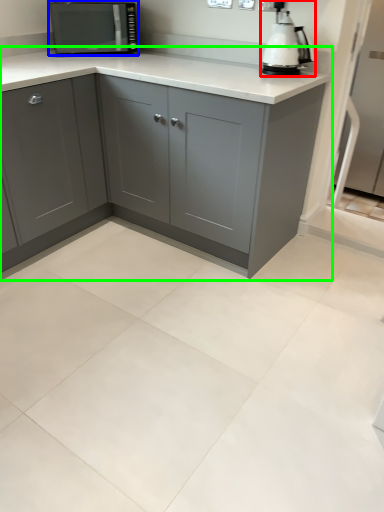
Question: Which object is positioned farthest from home appliance (highlighted by a red box)? Select from kitchen appliance (highlighted by a blue box) and cabinetry (highlighted by a green box).

Choices:
 (A) kitchen appliance
 (B) cabinetry

Answer: (A)